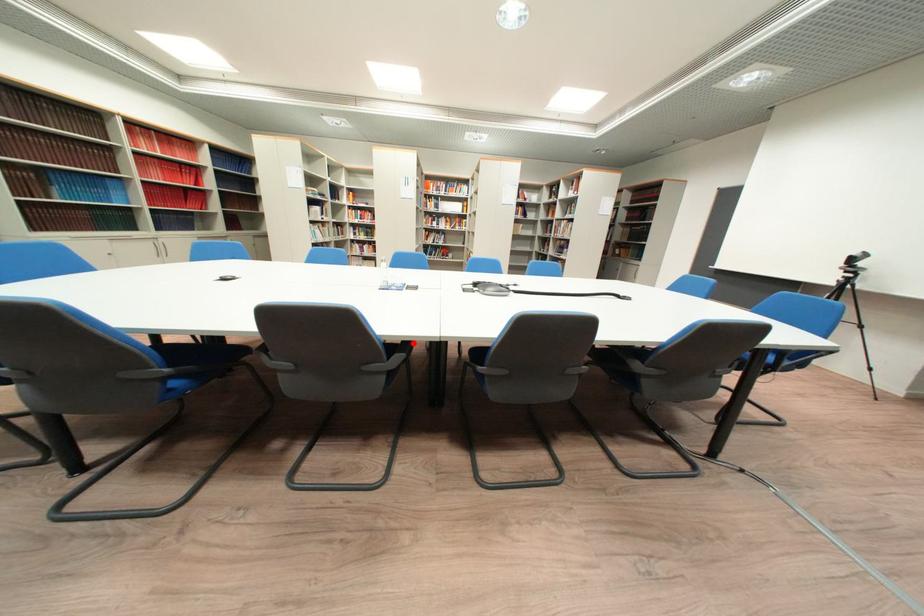
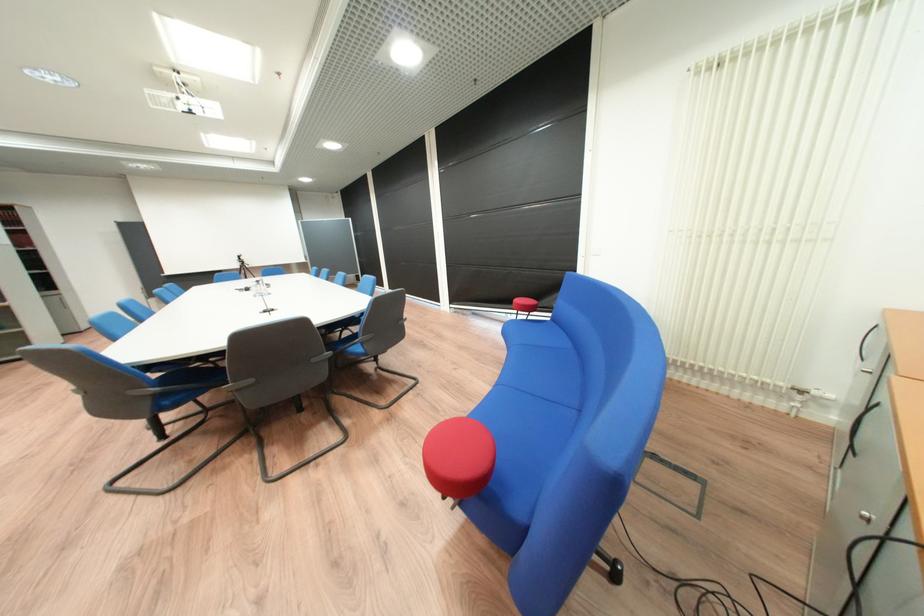
Question: I am providing you with two images of the same scene from different viewpoints. A red point is marked on the first image. Is the red point's position out of view in image 2?

Choices:
 (A) Yes
 (B) No

Answer: (A)